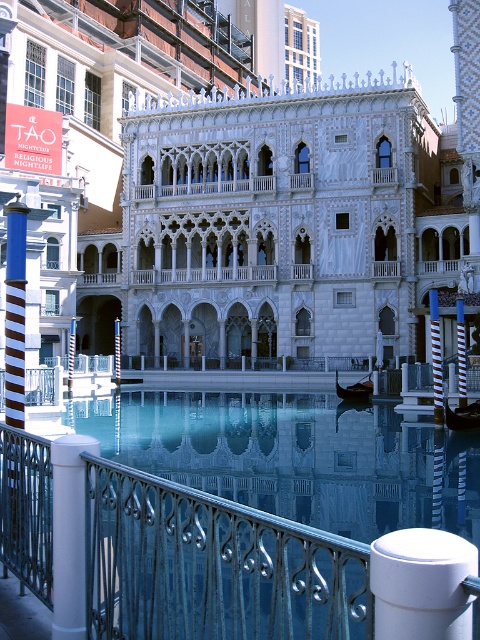
You are standing at the center of the canal in front of the white marble palace at center. If you walk straight towards the palace, will you reach it before reaching the gondolas docked along the canal?

The white marble palace at center is positioned at point (239, 195), so walking straight towards it from the center of the canal would lead you directly to the palace before encountering the gondolas docked along the canal.

In the scene shown: You are standing in front of the Venetian building and want to walk from the point at coordinates point (87, 580) to the point at coordinates point (60, 476). According to the scene description, which direction should you move relative to the building?

You should move towards the building because point (87, 580) is in front of point (60, 476), meaning the destination is closer to the building.